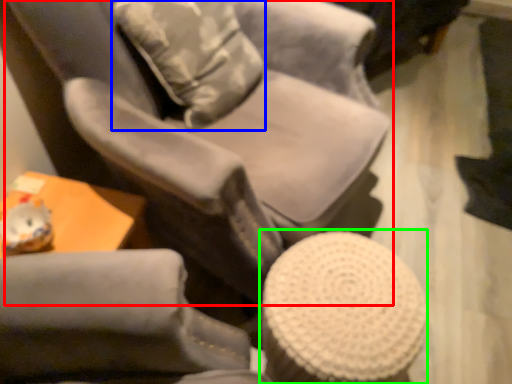
Question: Based on their relative distances, which object is nearer to chair (highlighted by a red box)? Choose from throw pillow (highlighted by a blue box) and bar stool (highlighted by a green box).

Choices:
 (A) throw pillow
 (B) bar stool

Answer: (A)